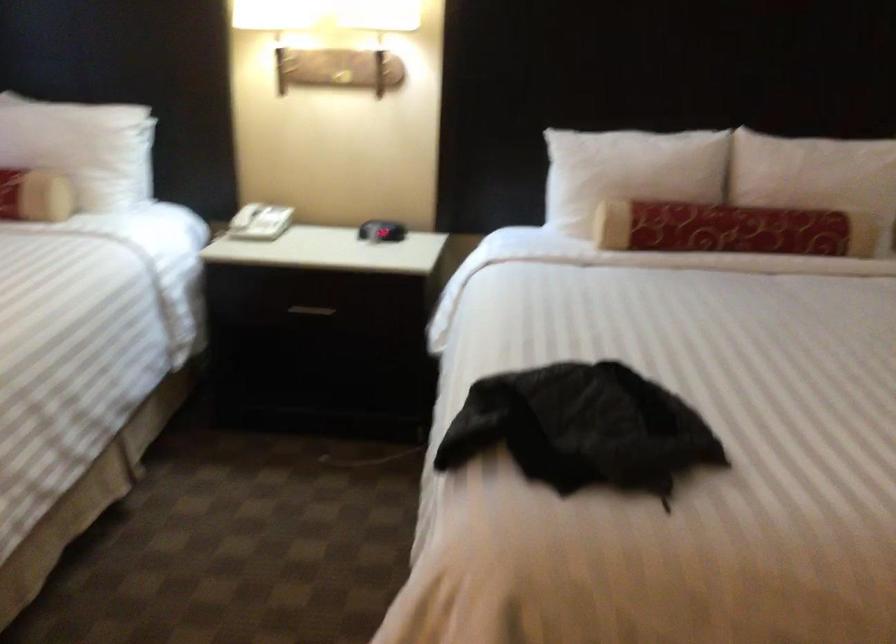
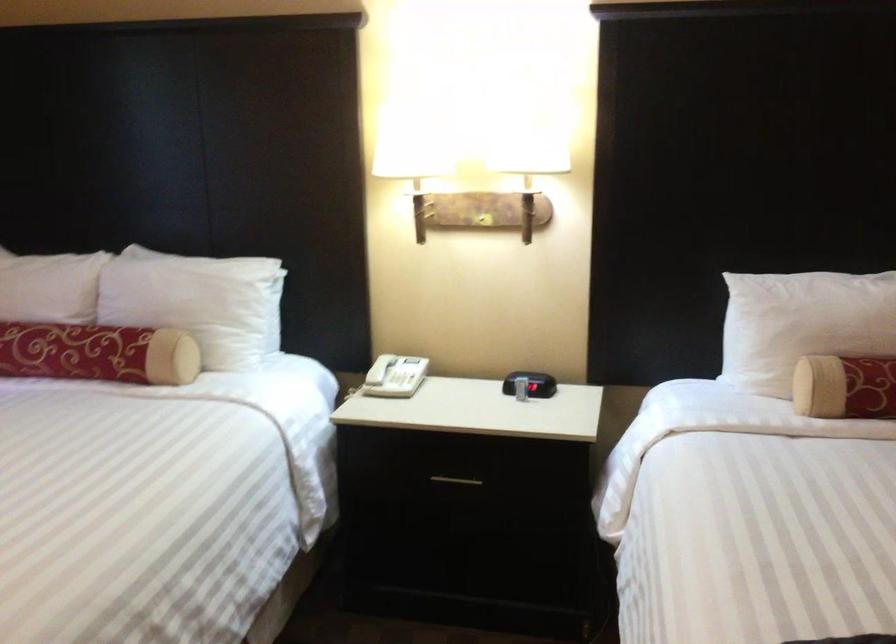
Where in the second image is the point corresponding to (x=71, y=146) from the first image?

(197, 301)